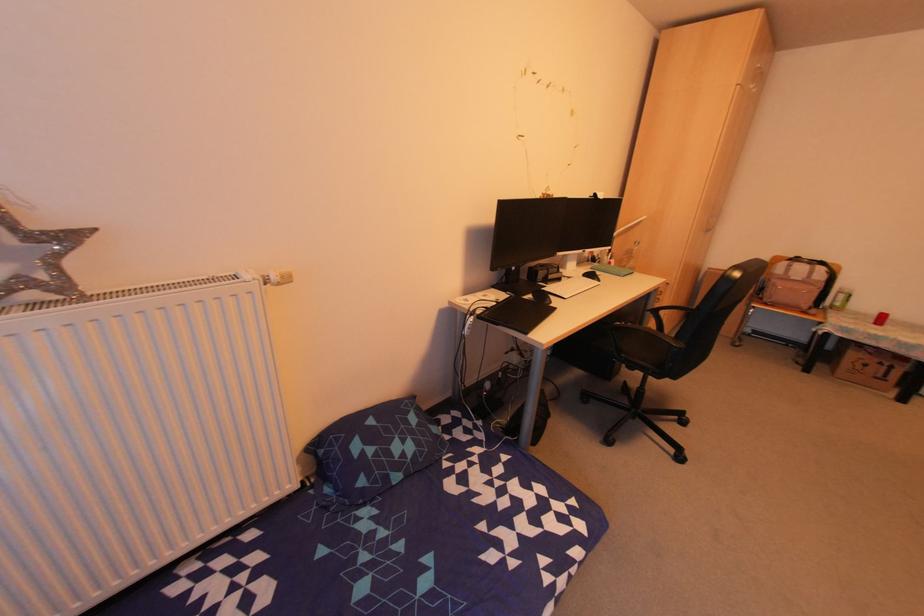
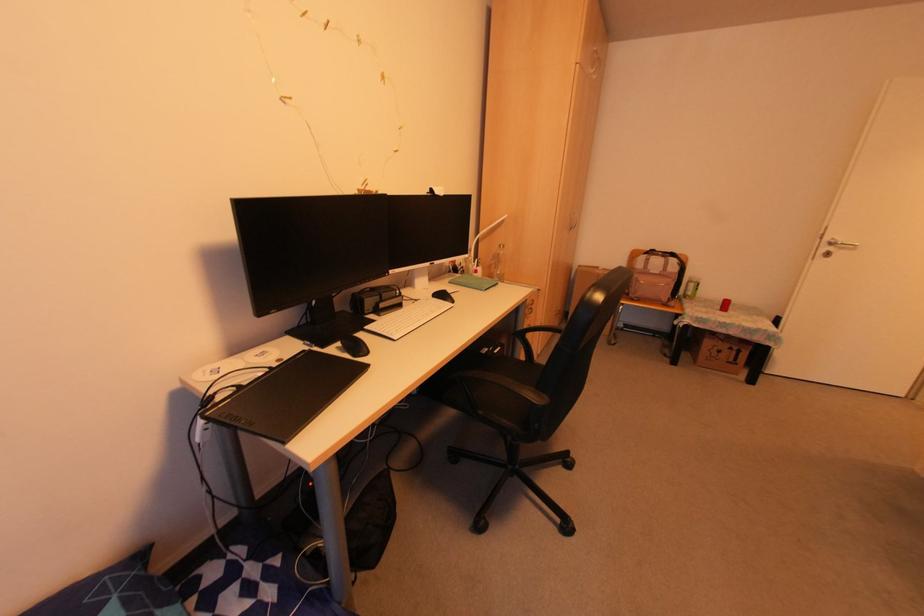
Where in the second image is the point corresponding to pixel 877 362 from the first image?

(725, 346)